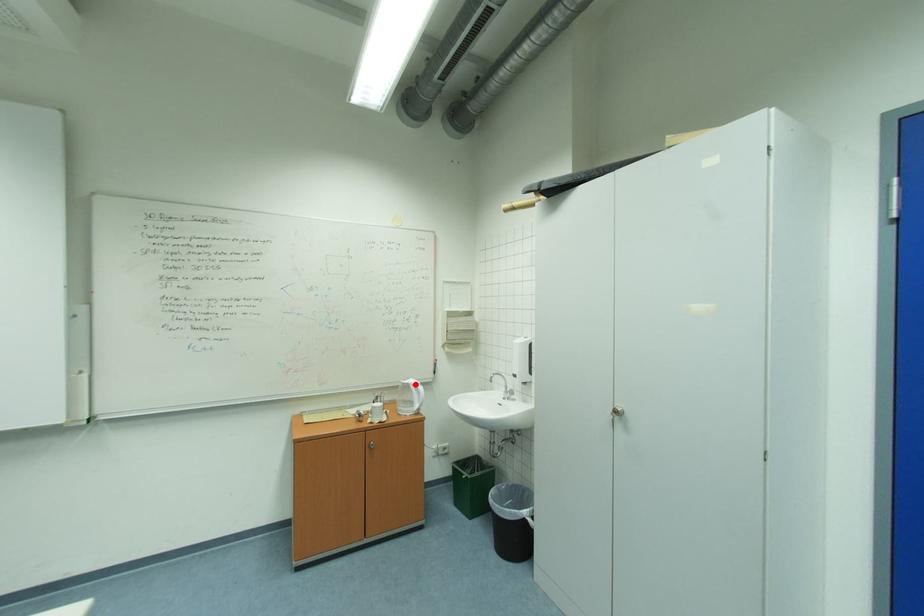
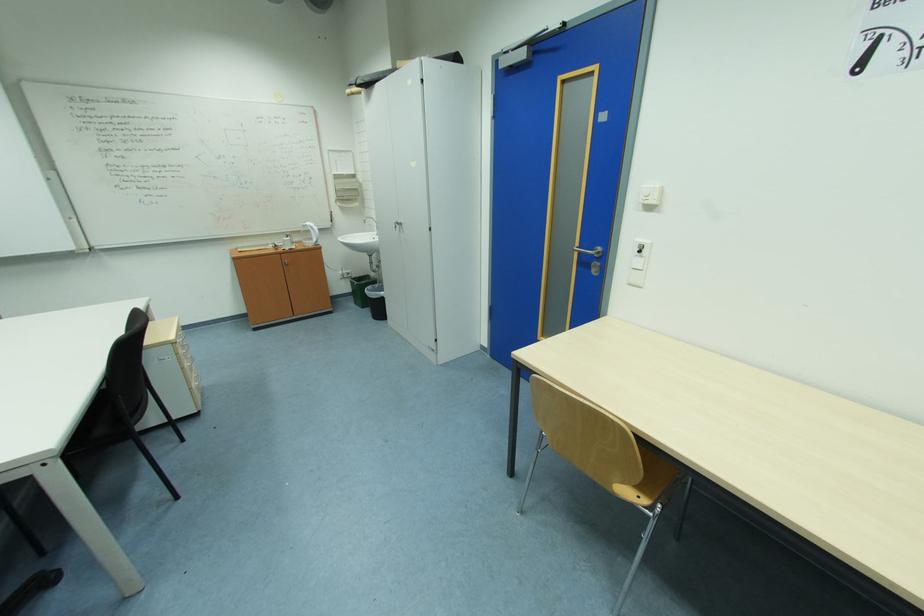
Find the pixel in the second image that matches the highlighted location in the first image.

(313, 225)